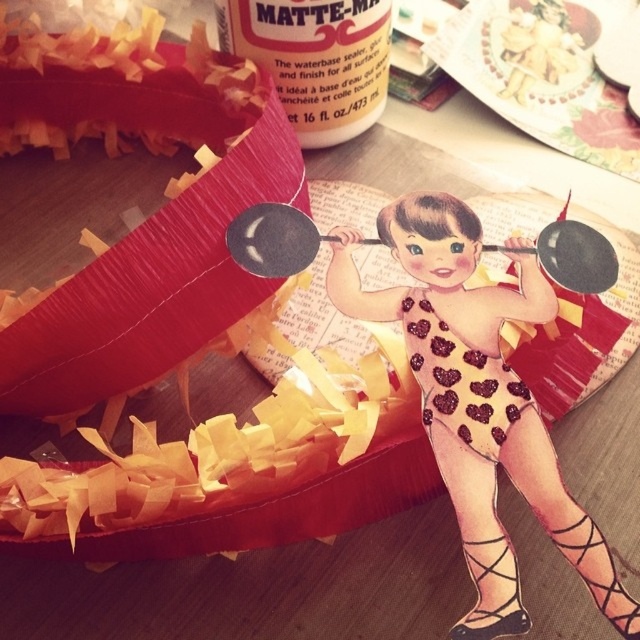
Question: Does matte paper piñata at upper left lie in front of heart-patterned fabric dress at center?

Choices:
 (A) yes
 (B) no

Answer: (B)

Question: Which point is closer to the camera?

Choices:
 (A) (513, 1)
 (B) (278, 275)
 (C) (504, 442)

Answer: (C)

Question: Among these objects, which one is nearest to the camera?

Choices:
 (A) black matte frying pan at center
 (B) matte paper piñata at upper left

Answer: (A)

Question: Is black matte frying pan at center above matte plastic toy at upper center?

Choices:
 (A) yes
 (B) no

Answer: (B)

Question: Does glittery heart-patterned swimsuit at center appear on the right side of black matte frying pan at center?

Choices:
 (A) no
 (B) yes

Answer: (B)

Question: Which point is farther to the camera?

Choices:
 (A) glittery heart-patterned swimsuit at center
 (B) matte plastic toy at upper center
 (C) matte ceramic plate at upper center
 (D) matte paper piñata at upper left

Answer: (B)